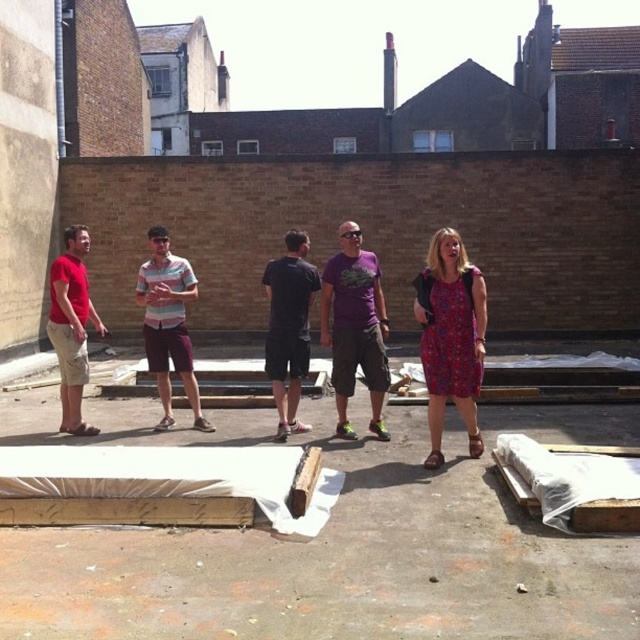
Does striped cotton shirt at center appear on the right side of black matte shorts at center?

In fact, striped cotton shirt at center is to the left of black matte shorts at center.

Consider the image. Does striped cotton shirt at center appear on the left side of black matte shorts at center?

Correct, you'll find striped cotton shirt at center to the left of black matte shorts at center.

Is point (189, 371) positioned behind point (282, 310)?

That is True.

At what (x,y) coordinates should I click in order to perform the action: click on striped cotton shirt at center. Please return your answer as a coordinate pair (x, y). Looking at the image, I should click on (168, 324).

From the picture: Between black matte shorts at center and matte red t-shirt at left, which one has more height?

matte red t-shirt at left

Can you confirm if black matte shorts at center is shorter than matte red t-shirt at left?

Yes.

Identify the location of black matte shorts at center. The height and width of the screenshot is (640, 640). (289, 326).

Is striped cotton shirt at center positioned in front of matte red t-shirt at left?

No, it is behind matte red t-shirt at left.

Is point (172, 294) closer to camera compared to point (65, 419)?

Yes.

The width and height of the screenshot is (640, 640). I want to click on striped cotton shirt at center, so click(168, 324).